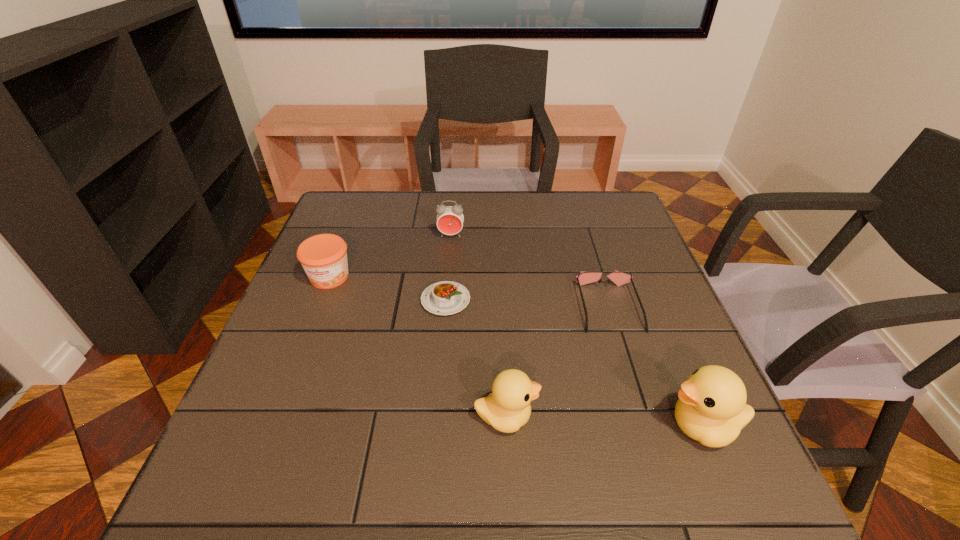
Locate an element on the screen. blank area located 0.270m on the face of the right duck is located at coordinates (517, 426).

What are the coordinates of `free point located 0.330m on the face of the right duck` in the screenshot? It's located at (485, 426).

In order to click on vacant space located on the face of the right duck in this screenshot , I will do `click(534, 426)`.

Find the location of `vacant space located 0.230m on the face of the farthest object`. vacant space located 0.230m on the face of the farthest object is located at coordinates (445, 295).

At what (x,y) coordinates should I click in order to perform the action: click on free spot located on the bridge of the sunglasses. Please return your answer as a coordinate pair (x, y). The image size is (960, 540). Looking at the image, I should click on (634, 386).

This screenshot has width=960, height=540. Find the location of `vacant space positioned 0.120m on the front label of the jam`. vacant space positioned 0.120m on the front label of the jam is located at coordinates 309,329.

This screenshot has height=540, width=960. In order to click on vacant area situated on the left of the pudding in this screenshot , I will do `click(323, 300)`.

Where is `object that is at the far edge`? object that is at the far edge is located at coordinates (450, 219).

Identify the location of object present at the left edge. (323, 257).

Find the location of `duck located at the right edge`. duck located at the right edge is located at coordinates (711, 409).